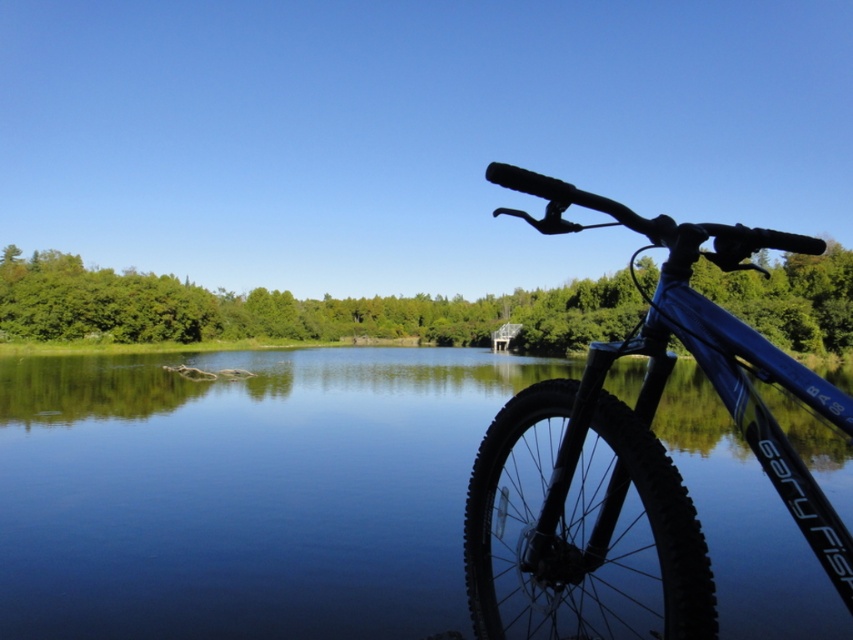
Is the position of glossy blue water at center more distant than that of blue matte bicycle at right?

Yes, it is.

Consider the image. Is glossy blue water at center to the right of blue matte bicycle at right from the viewer's perspective?

In fact, glossy blue water at center is to the left of blue matte bicycle at right.

Locate an element on the screen. The image size is (853, 640). glossy blue water at center is located at coordinates point(242,492).

Locate an element on the screen. This screenshot has width=853, height=640. glossy blue water at center is located at coordinates (242, 492).